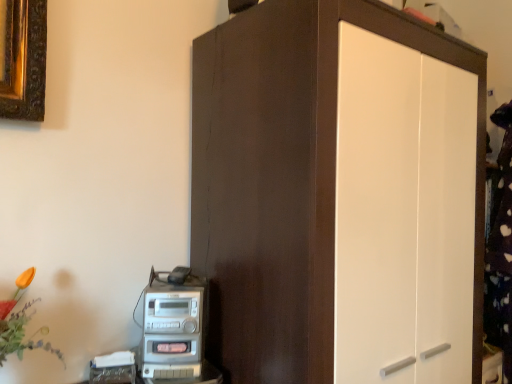
Identify the location of empty space that is ontop of silver metallic stereo at lower left (from a real-world perspective). The image size is (512, 384). (177, 284).